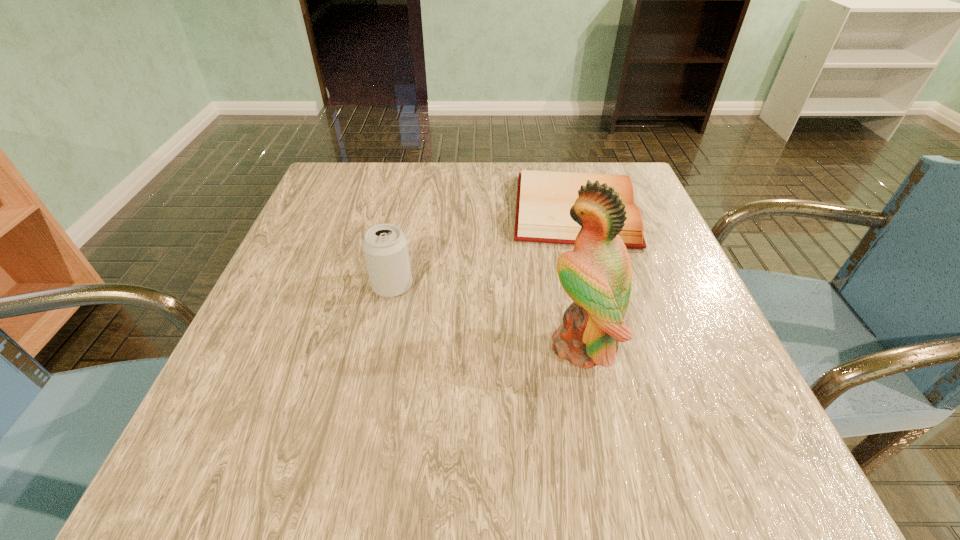
Image resolution: width=960 pixels, height=540 pixels. I want to click on vacant space situated 0.120m on the front of the farthest object, so click(598, 292).

You are a GUI agent. You are given a task and a screenshot of the screen. Output one action in this format:
    pyautogui.click(x=<x>, y=<y>)
    Task: Click on the object positioned at the far edge
    
    Given the screenshot: What is the action you would take?
    pyautogui.click(x=544, y=198)

At what (x,y) coordinates should I click in order to perform the action: click on object situated at the right edge. Please return your answer as a coordinate pair (x, y). Looking at the image, I should click on (544, 198).

The image size is (960, 540). In order to click on object that is at the far right corner in this screenshot , I will do `click(544, 198)`.

This screenshot has height=540, width=960. Find the location of `vacant space at the far edge`. vacant space at the far edge is located at coordinates (509, 170).

Locate an element on the screen. The width and height of the screenshot is (960, 540). vacant area at the near edge is located at coordinates pyautogui.click(x=593, y=444).

In the image, there is a desktop. Where is `vacant space at the left edge`? The width and height of the screenshot is (960, 540). vacant space at the left edge is located at coordinates (304, 286).

In the image, there is a desktop. At what (x,y) coordinates should I click in order to perform the action: click on vacant region at the right edge. Please return your answer as a coordinate pair (x, y). This screenshot has width=960, height=540. Looking at the image, I should click on (731, 422).

Find the location of `vacant region at the far left corner`. vacant region at the far left corner is located at coordinates (372, 204).

In order to click on empty space that is in between the parrot and the leftmost object in this screenshot , I will do (487, 315).